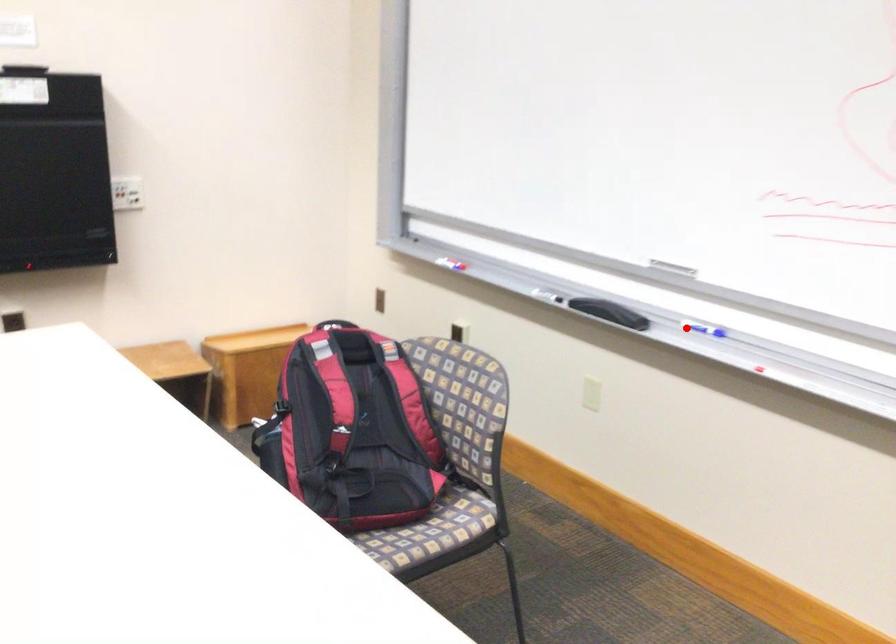
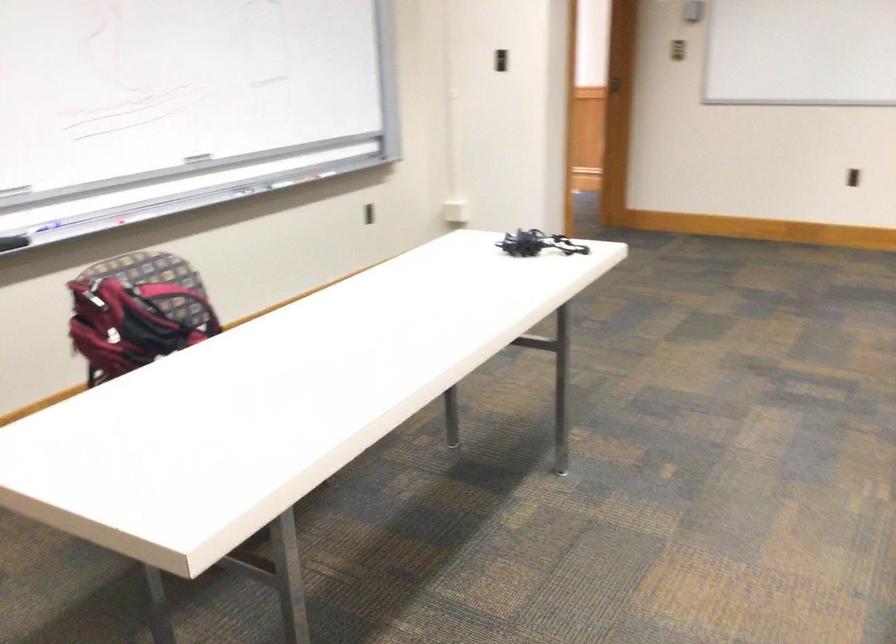
Question: A red point is marked in image1. In image2, is the corresponding 3D point closer to the camera or farther? Reply with the corresponding letter.

Choices:
 (A) The corresponding 3D point is closer.
 (B) The corresponding 3D point is farther.

Answer: (B)